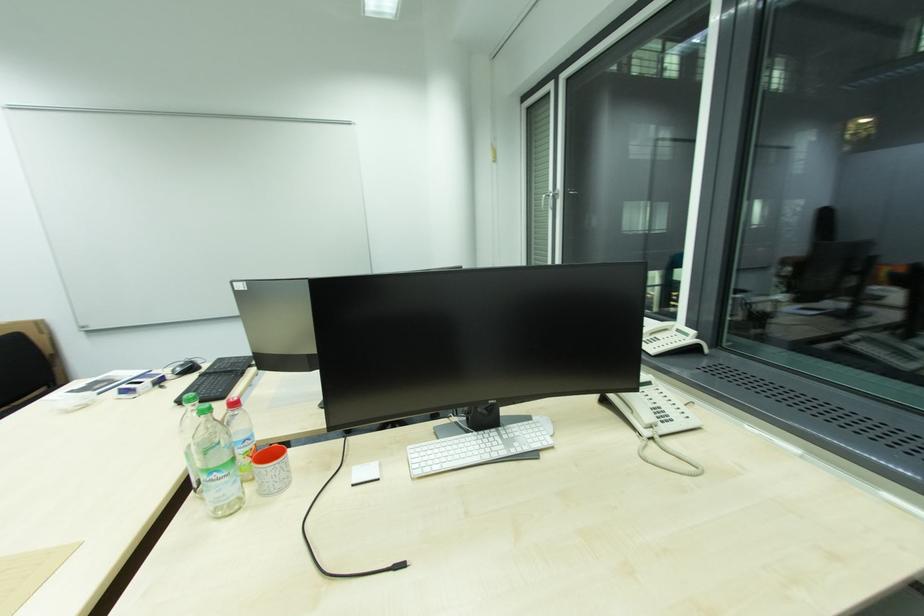
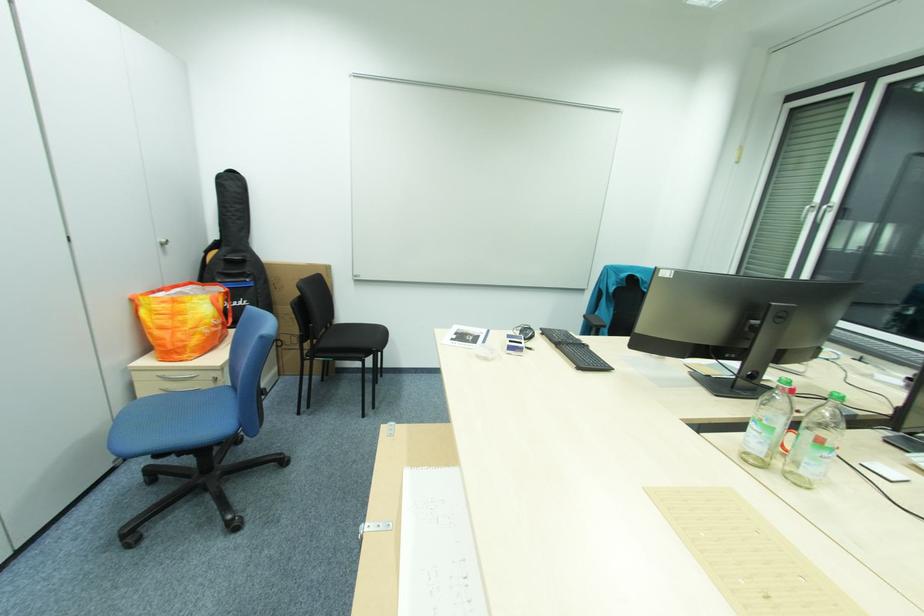
Question: The images are taken continuously from a first-person perspective. In which direction are you moving?

Choices:
 (A) Left
 (B) Right
 (C) Forward
 (D) Backward

Answer: (A)